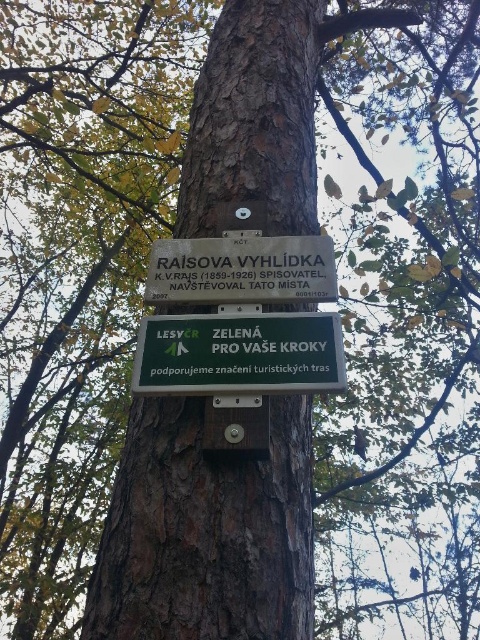
Question: Is green matte sign at center wider than white wooden sign at center?

Choices:
 (A) yes
 (B) no

Answer: (A)

Question: Which of the following is the closest to the observer?

Choices:
 (A) white wooden sign at center
 (B) green matte sign at center

Answer: (B)

Question: Is green matte sign at center bigger than white wooden sign at center?

Choices:
 (A) yes
 (B) no

Answer: (B)

Question: Does green matte sign at center appear on the left side of white wooden sign at center?

Choices:
 (A) no
 (B) yes

Answer: (B)

Question: Among these objects, which one is nearest to the camera?

Choices:
 (A) white wooden sign at center
 (B) green matte sign at center

Answer: (B)